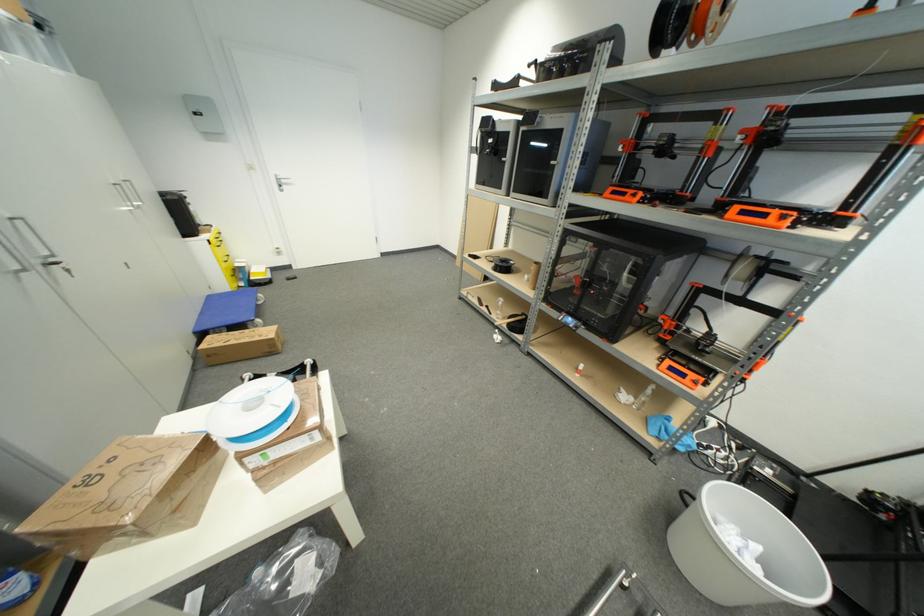
Where is `white filament spool`? This screenshot has width=924, height=616. white filament spool is located at coordinates (746, 551).